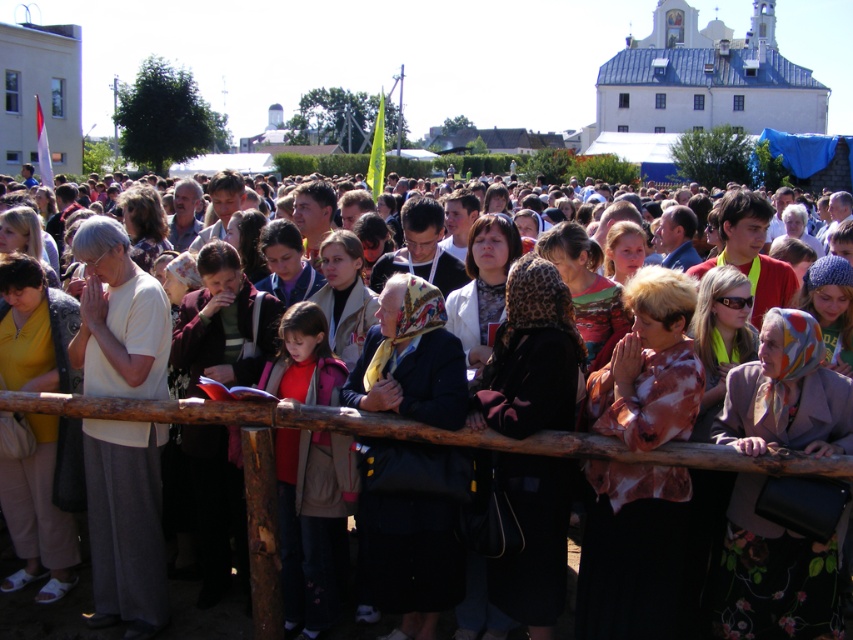
Is point (114, 349) farther from viewer compared to point (437, 312)?

No.

Who is more forward, (83,333) or (386,604)?

Point (386,604) is more forward.

The height and width of the screenshot is (640, 853). Identify the location of white matte shirt at left. (125, 524).

What do you see at coordinates (410, 358) in the screenshot?
I see `dark blue fabric coat at center` at bounding box center [410, 358].

Looking at this image, is dark blue fabric coat at center closer to the viewer compared to matte black jacket at center?

No, it is not.

Find the location of a particular element. dark blue fabric coat at center is located at coordinates (410, 358).

Who is taller, white matte shirt at left or matte black jacket at center?

white matte shirt at left

Which is behind, point (94, 280) or point (564, 433)?

Point (94, 280)

Image resolution: width=853 pixels, height=640 pixels. What do you see at coordinates (125, 524) in the screenshot? I see `white matte shirt at left` at bounding box center [125, 524].

The image size is (853, 640). Identify the location of white matte shirt at left. (125, 524).